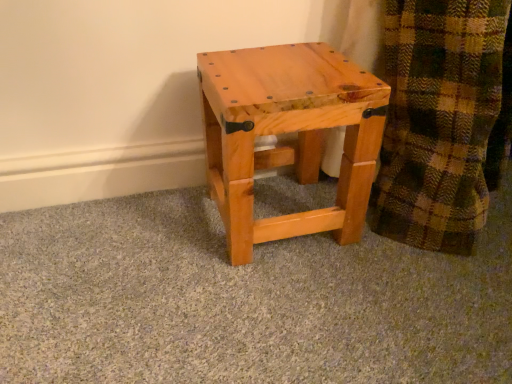
Where is `natural wood stool at center`? This screenshot has width=512, height=384. natural wood stool at center is located at coordinates (288, 132).

Describe the element at coordinates (288, 132) in the screenshot. The image size is (512, 384). I see `natural wood stool at center` at that location.

What is the approximate height of natural wood stool at center?

The height of natural wood stool at center is 11.68 inches.

Locate an element on the screen. The height and width of the screenshot is (384, 512). natural wood stool at center is located at coordinates (288, 132).